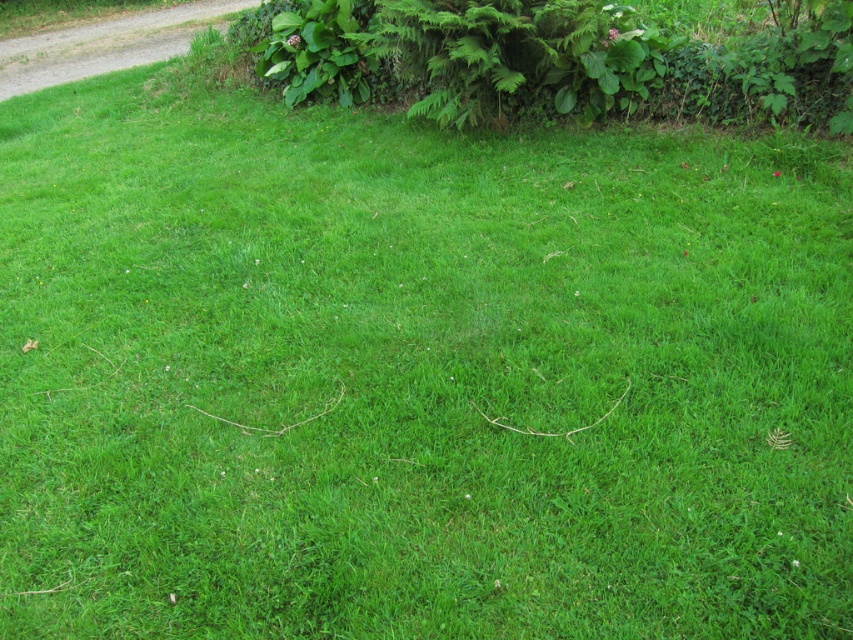
Question: Observing the image, what is the correct spatial positioning of green leafy hedge at upper center in reference to gravel at upper left?

Choices:
 (A) right
 (B) left

Answer: (A)

Question: Which object is closer to the camera taking this photo?

Choices:
 (A) green leafy hedge at upper center
 (B) gravel at upper left

Answer: (A)

Question: Is green leafy hedge at upper center bigger than gravel at upper left?

Choices:
 (A) yes
 (B) no

Answer: (B)

Question: Does green leafy hedge at upper center lie in front of gravel at upper left?

Choices:
 (A) no
 (B) yes

Answer: (B)

Question: Which object is farther from the camera taking this photo?

Choices:
 (A) green leafy hedge at upper center
 (B) gravel at upper left

Answer: (B)